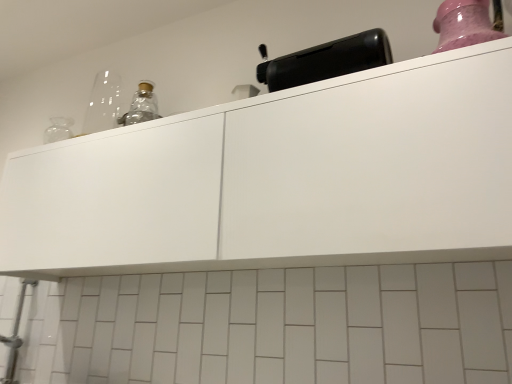
Question: Is pink glossy jar at upper right taller or shorter than black plastic toaster at upper center?

Choices:
 (A) short
 (B) tall

Answer: (B)

Question: Does point (466, 29) appear closer or farther from the camera than point (295, 74)?

Choices:
 (A) closer
 (B) farther

Answer: (A)

Question: Which object is the closest to the black plastic toaster at upper center?

Choices:
 (A) pink glossy jar at upper right
 (B) white matte cabinet at upper center

Answer: (A)

Question: Considering the real-world distances, which object is closest to the black plastic toaster at upper center?

Choices:
 (A) white matte cabinet at upper center
 (B) pink glossy jar at upper right

Answer: (B)